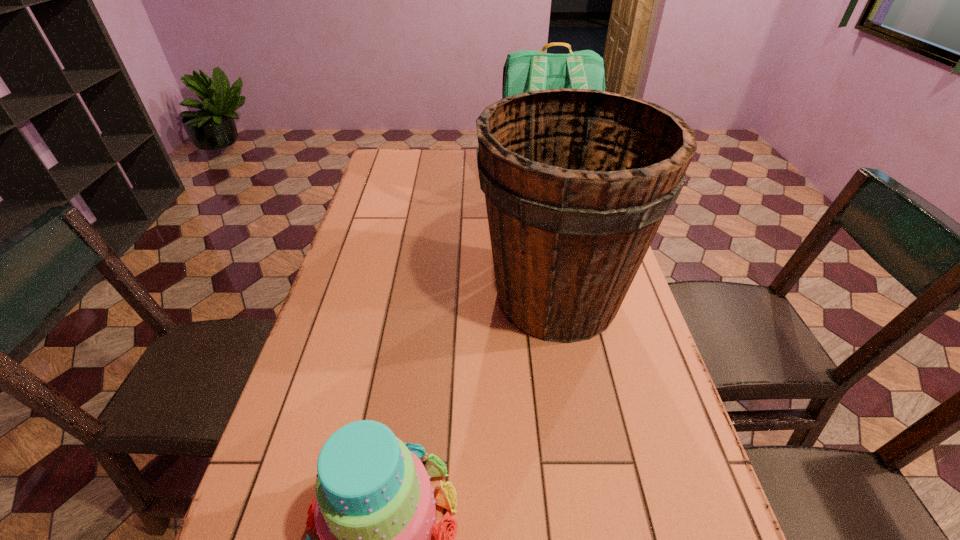
Locate an element on the screen. the farthest object is located at coordinates (526, 70).

Where is `the second nearest object`? Image resolution: width=960 pixels, height=540 pixels. the second nearest object is located at coordinates (577, 182).

Locate an element on the screen. This screenshot has height=540, width=960. free spot located 0.330m on the back of the backpack is located at coordinates (562, 287).

This screenshot has width=960, height=540. Identify the location of vacant area situated on the left of the second farthest object. point(372,298).

Image resolution: width=960 pixels, height=540 pixels. What are the coordinates of `object present at the far edge` in the screenshot? It's located at coord(526,70).

Find the location of a particular element. The width and height of the screenshot is (960, 540). backpack at the right edge is located at coordinates (526, 70).

At what (x,y) coordinates should I click in order to perform the action: click on bucket that is at the right edge. Please return your answer as a coordinate pair (x, y). Looking at the image, I should click on (577, 182).

This screenshot has height=540, width=960. Find the location of `object located in the far right corner section of the desktop`. object located in the far right corner section of the desktop is located at coordinates (526, 70).

Where is `vacant space at the far edge of the desktop`? This screenshot has height=540, width=960. vacant space at the far edge of the desktop is located at coordinates (433, 177).

This screenshot has height=540, width=960. Find the location of `vacant area at the left edge`. vacant area at the left edge is located at coordinates (357, 310).